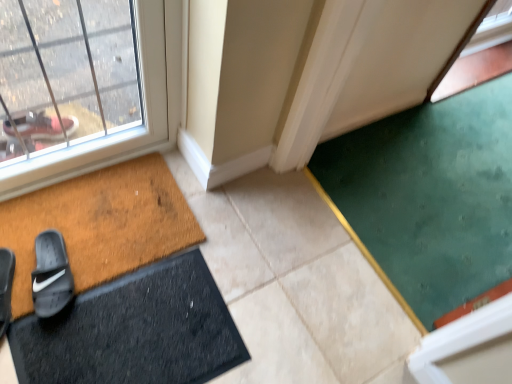
I want to click on unoccupied space behind black suede slide at lower left, acting as the second footwear starting from the right, so click(x=34, y=231).